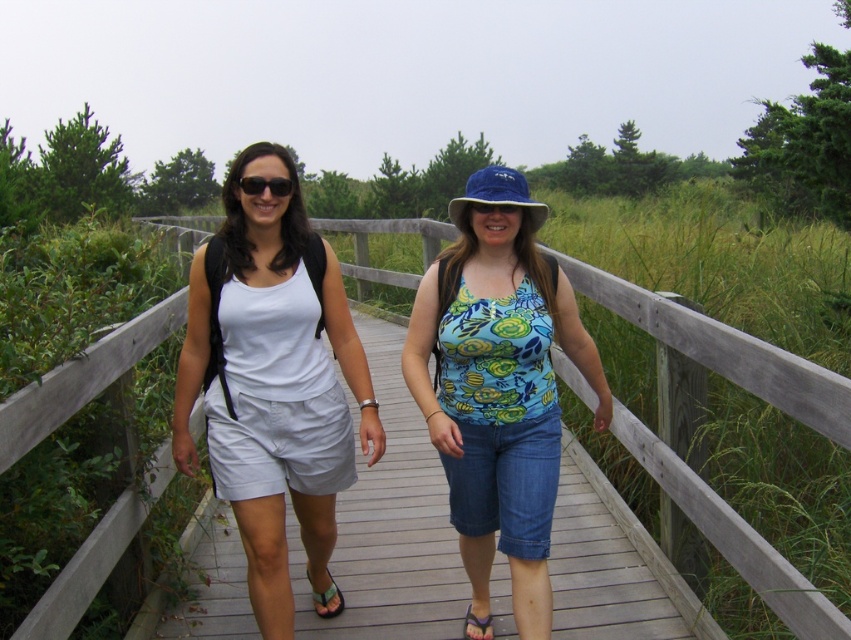
Does blue printed tank top at center have a smaller size compared to matte black sunglasses at center?

No, blue printed tank top at center is not smaller than matte black sunglasses at center.

Can you confirm if blue printed tank top at center is wider than matte black sunglasses at center?

Correct, the width of blue printed tank top at center exceeds that of matte black sunglasses at center.

Does point (493, 342) lie behind point (254, 177)?

No, (493, 342) is in front of (254, 177).

Locate an element on the screen. Image resolution: width=851 pixels, height=640 pixels. blue printed tank top at center is located at coordinates tap(498, 387).

Who is higher up, wooden bridge at center or green fabric sandal at lower center?

wooden bridge at center

Does point (789, 579) come farther from viewer compared to point (318, 609)?

No.

Locate an element on the screen. This screenshot has width=851, height=640. wooden bridge at center is located at coordinates (701, 440).

From the picture: Which is below, blue fabric hat at center or blue fabric goggles at center?

blue fabric goggles at center is lower down.

Can you confirm if blue fabric hat at center is smaller than blue fabric goggles at center?

Actually, blue fabric hat at center might be larger than blue fabric goggles at center.

Who is more forward, (464,193) or (510,205)?

Point (510,205) is in front.

Locate an element on the screen. This screenshot has height=640, width=851. blue fabric hat at center is located at coordinates (497, 195).